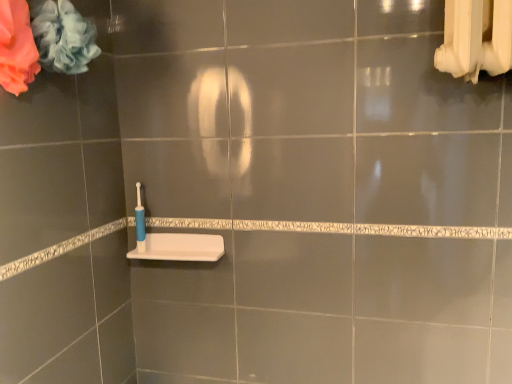
Question: Is blue plastic toothbrush at lower left bigger or smaller than white matte sink at lower center?

Choices:
 (A) big
 (B) small

Answer: (B)

Question: Would you say blue plastic toothbrush at lower left is to the left or to the right of white matte sink at lower center in the picture?

Choices:
 (A) right
 (B) left

Answer: (B)

Question: Considering the real-world distances, which object is farthest from the blue plastic toothbrush at lower left?

Choices:
 (A) white matte sink at lower center
 (B) soft pink fabric at upper left, arranged as the 1th flower when viewed from the left
 (C) soft blue fabric at upper left, the first flower positioned from the right

Answer: (B)

Question: Considering the real-world distances, which object is farthest from the white matte sink at lower center?

Choices:
 (A) soft blue fabric at upper left, which ranks as the 2th flower in left-to-right order
 (B) blue plastic toothbrush at lower left
 (C) soft pink fabric at upper left, arranged as the 1th flower when viewed from the left

Answer: (C)